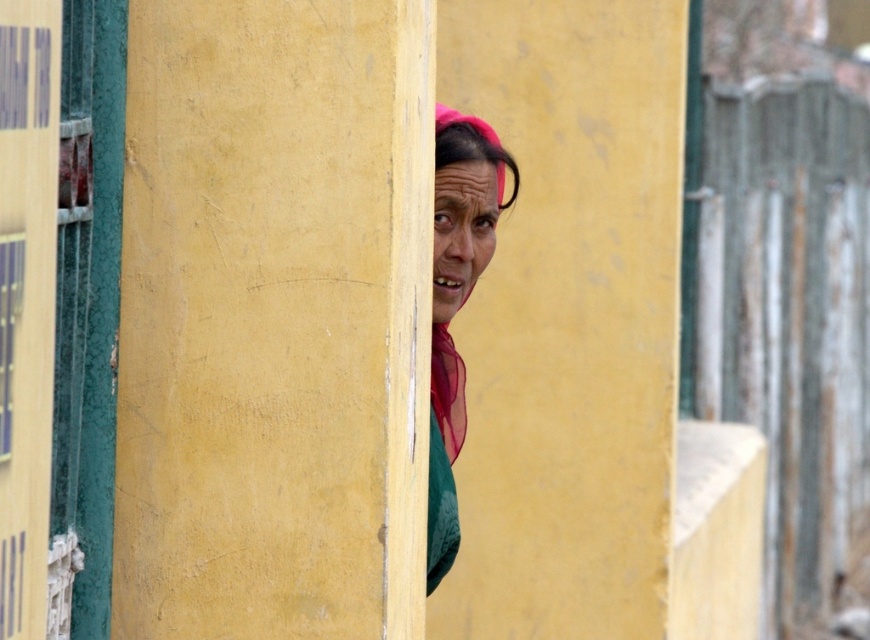
Which is more to the right, pink sheer scarf at center or translucent pink shawl at center?

translucent pink shawl at center

Between point (460, 385) and point (443, 333), which one is positioned behind?

Point (460, 385)

Does point (482, 204) lie in front of point (453, 422)?

Yes, it is.

Locate an element on the screen. The width and height of the screenshot is (870, 640). pink sheer scarf at center is located at coordinates (456, 300).

Which of these two, translucent pink shawl at center or pink fabric headscarf at center, stands shorter?

translucent pink shawl at center is shorter.

Does translucent pink shawl at center have a lesser width compared to pink fabric headscarf at center?

Indeed, translucent pink shawl at center has a lesser width compared to pink fabric headscarf at center.

Describe the element at coordinates (447, 388) in the screenshot. I see `translucent pink shawl at center` at that location.

The width and height of the screenshot is (870, 640). Identify the location of translucent pink shawl at center. (447, 388).

Who is shorter, pink sheer scarf at center or pink fabric headscarf at center?

pink fabric headscarf at center

Based on the photo, is pink sheer scarf at center thinner than pink fabric headscarf at center?

No, pink sheer scarf at center is not thinner than pink fabric headscarf at center.

Measure the distance between pink sheer scarf at center and camera.

pink sheer scarf at center and camera are 5.01 meters apart from each other.

I want to click on pink sheer scarf at center, so click(x=456, y=300).